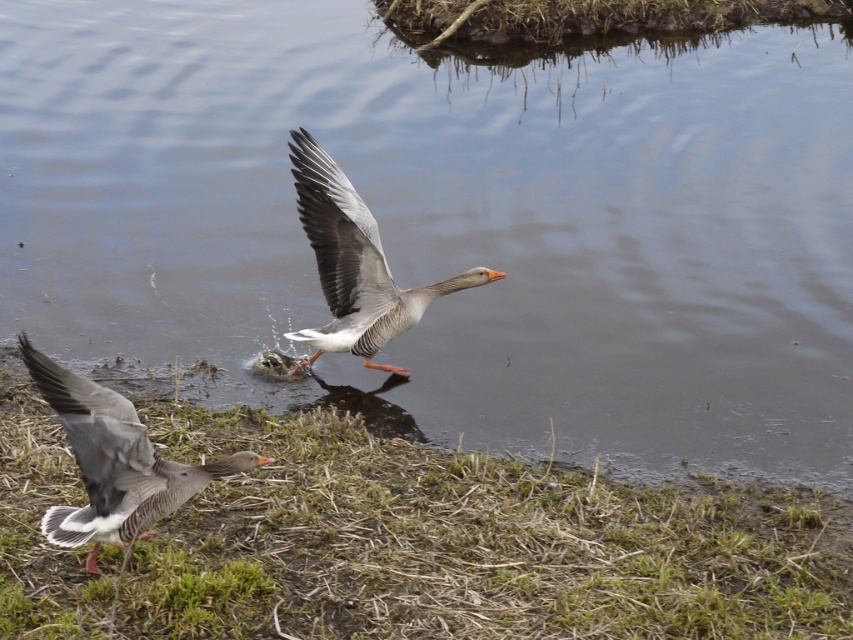
You are a photographer trying to capture both geese in a single shot. You notice two points marked in the scene. One is at point (421, 456) and the other at point (117, 531). Which point is closer to your camera lens?

Point (421, 456) is closer to the camera lens than point (117, 531) because it is further to the viewer.

Looking at this image, you are standing at the edge of the water and see both the green dry grass at lower left and the gray matte duck at lower left. Which object is positioned more to the left side of the scene?

The gray matte duck at lower left is positioned more to the left side of the scene because the green dry grass at lower left is to the right of it.